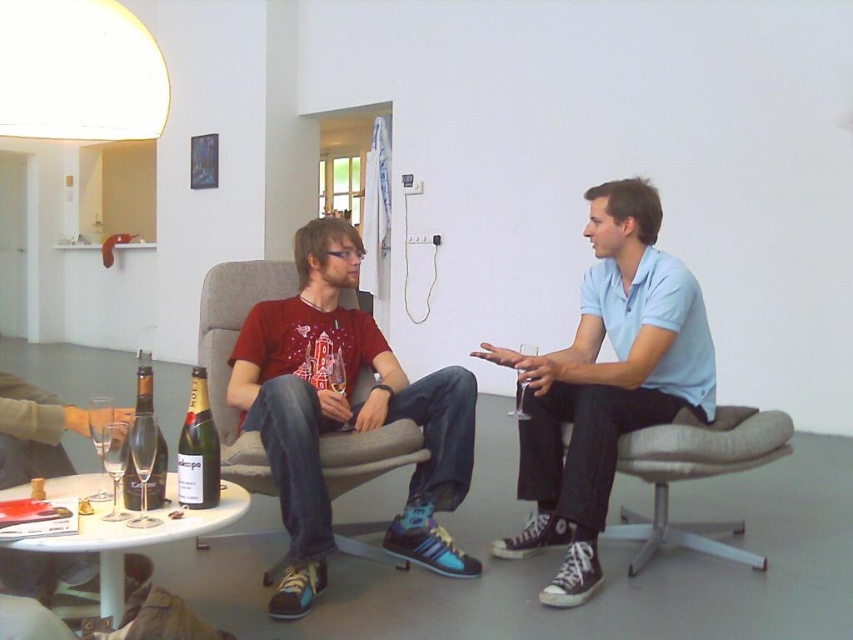
Question: Does light blue cotton shirt at center appear on the left side of beige fabric swivel chair at lower right?

Choices:
 (A) no
 (B) yes

Answer: (B)

Question: Which object appears closest to the camera in this image?

Choices:
 (A) matte glass wine bottle at center
 (B) gold foil champagne bottle at center
 (C) matte red t-shirt at center

Answer: (A)

Question: Which point is farther from the camera taking this photo?

Choices:
 (A) (149, 476)
 (B) (701, 464)
 (C) (207, 492)

Answer: (B)

Question: Estimate the real-world distances between objects in this image. Which object is farther from the matte glass wine bottle at center?

Choices:
 (A) beige fabric swivel chair at lower right
 (B) gold foil champagne bottle at center
 (C) light blue cotton shirt at center

Answer: (A)

Question: In this image, where is beige fabric swivel chair at lower right located relative to matte glass wine bottle at center?

Choices:
 (A) right
 (B) left

Answer: (A)

Question: Can you confirm if light blue cotton shirt at center is positioned above matte glass wine bottle at center?

Choices:
 (A) yes
 (B) no

Answer: (A)